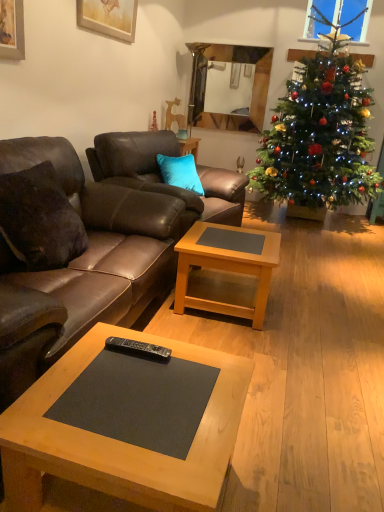
This screenshot has height=512, width=384. I want to click on vacant location behind black plastic remote control at center, so click(x=135, y=338).